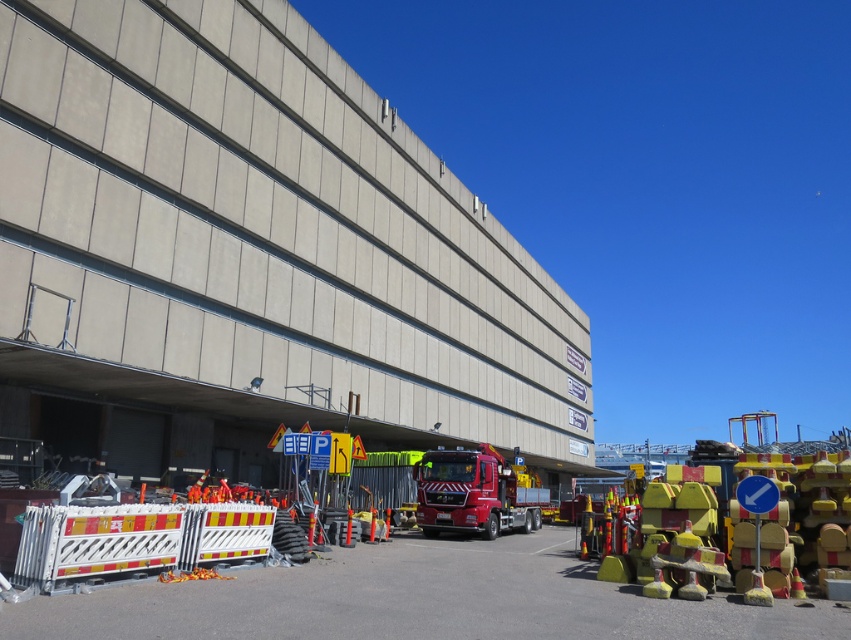
You are a delivery driver who needs to navigate through the construction site shown in the image. There is a point marked at coordinate (418,600). What is located at this point?

The point at coordinate (418,600) indicates yellow rubber cones at lower right.

You are a delivery driver who needs to navigate through the construction site. Your vehicle is 2 meters wide. There is a path between the concrete building at center and the white plastic barricade at lower left. Can your vehicle pass through this path?

The distance between the concrete building at center and the white plastic barricade at lower left is 19.72 meters. Since your vehicle is only 2 meters wide, it can easily pass through the path between them.